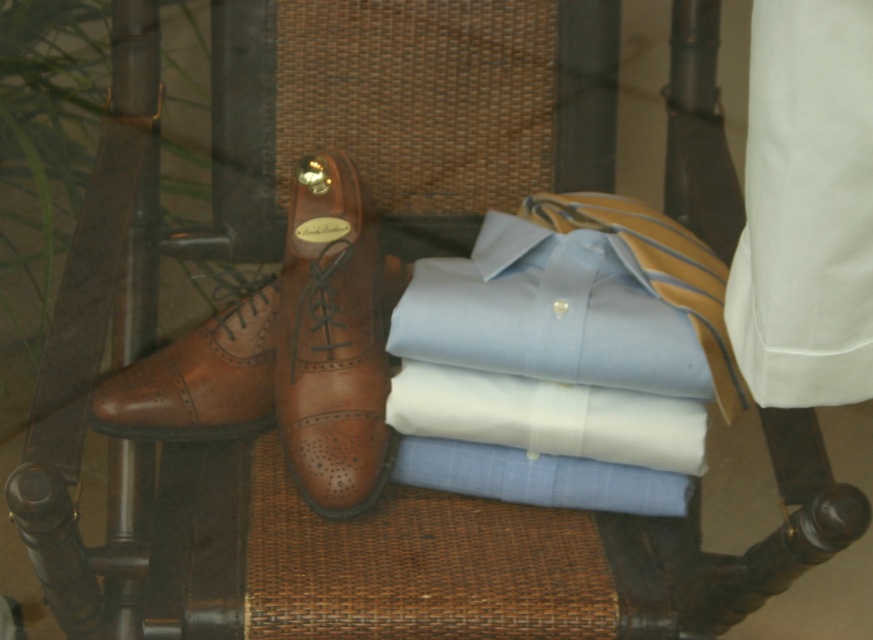
You are a customer trying to organize your wardrobe. You have a light blue cotton shirt at center and a brown leather shoe at center. According to the image, which item is positioned to the right of the other?

The light blue cotton shirt at center is to the right of the brown leather shoe at center.

You are a tailor who needs to place a 2.5 inch wide decorative ribbon between the light blue cotton shirt at center and the white cotton shirt at center. Can the ribbon fit in the space between them?

The distance between the light blue cotton shirt at center and white cotton shirt at center is 2.54 inches, which is slightly wider than the 2.5 inch ribbon. The ribbon can fit between them with a small amount of space remaining.